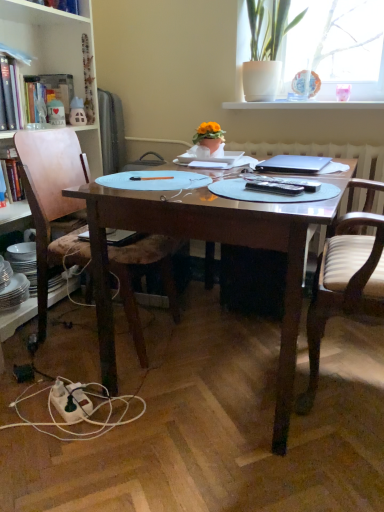
Question: Can you confirm if white glossy window sill at upper center is shorter than wooden chair at left, marked as the second chair in a right-to-left arrangement?

Choices:
 (A) no
 (B) yes

Answer: (B)

Question: Is white glossy window sill at upper center with wooden chair at left, acting as the first chair starting from the left?

Choices:
 (A) no
 (B) yes

Answer: (A)

Question: Is white glossy window sill at upper center positioned with its back to wooden chair at left, marked as the second chair in a right-to-left arrangement?

Choices:
 (A) yes
 (B) no

Answer: (B)

Question: Considering the relative sizes of white glossy window sill at upper center and wooden chair at left, marked as the second chair in a right-to-left arrangement, in the image provided, is white glossy window sill at upper center taller than wooden chair at left, marked as the second chair in a right-to-left arrangement,?

Choices:
 (A) yes
 (B) no

Answer: (B)

Question: Are white glossy window sill at upper center and wooden chair at left, acting as the first chair starting from the left, located far from each other?

Choices:
 (A) yes
 (B) no

Answer: (A)

Question: Looking at the image, does wooden chair at left, acting as the first chair starting from the left, seem bigger or smaller compared to wooden bookcase at left?

Choices:
 (A) small
 (B) big

Answer: (A)

Question: Considering the positions of wooden chair at left, acting as the first chair starting from the left, and wooden bookcase at left in the image, is wooden chair at left, acting as the first chair starting from the left, wider or thinner than wooden bookcase at left?

Choices:
 (A) thin
 (B) wide

Answer: (B)

Question: From the image's perspective, is wooden chair at left, marked as the second chair in a right-to-left arrangement, positioned above or below wooden bookcase at left?

Choices:
 (A) below
 (B) above

Answer: (A)

Question: Is wooden chair at left, marked as the second chair in a right-to-left arrangement, in front of or behind wooden bookcase at left in the image?

Choices:
 (A) behind
 (B) front

Answer: (A)

Question: Looking at the image, does hardcover book at left, which is counted as the first book, starting from the front, seem bigger or smaller compared to white ceramic pot at upper right?

Choices:
 (A) big
 (B) small

Answer: (B)

Question: Considering the positions of point (13, 110) and point (284, 15), is point (13, 110) closer or farther from the camera than point (284, 15)?

Choices:
 (A) farther
 (B) closer

Answer: (B)

Question: Considering the positions of hardcover book at left, which is counted as the 3th book, starting from the back, and white ceramic pot at upper right in the image, is hardcover book at left, which is counted as the 3th book, starting from the back, taller or shorter than white ceramic pot at upper right?

Choices:
 (A) short
 (B) tall

Answer: (A)

Question: From the image's perspective, is hardcover book at left, which is counted as the 3th book, starting from the back, positioned above or below white ceramic pot at upper right?

Choices:
 (A) above
 (B) below

Answer: (B)

Question: Considering the relative positions of wooden bookcase at left and white striped wood chair at right, marked as the second chair in a left-to-right arrangement, in the image provided, is wooden bookcase at left to the left or to the right of white striped wood chair at right, marked as the second chair in a left-to-right arrangement,?

Choices:
 (A) left
 (B) right

Answer: (A)

Question: Is wooden bookcase at left taller or shorter than white striped wood chair at right, marked as the second chair in a left-to-right arrangement?

Choices:
 (A) tall
 (B) short

Answer: (A)